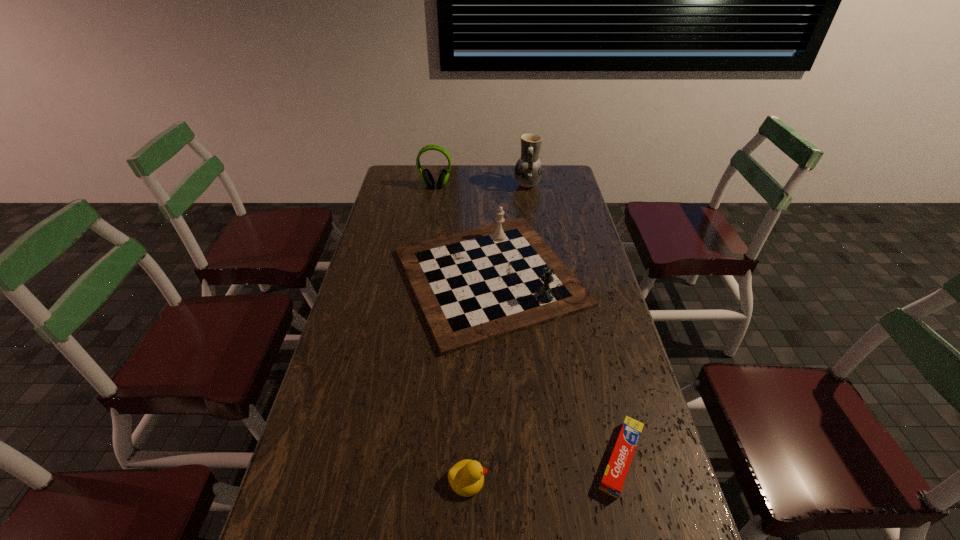
The height and width of the screenshot is (540, 960). I want to click on object situated at the far left corner, so click(427, 178).

Image resolution: width=960 pixels, height=540 pixels. In order to click on object that is at the far right corner in this screenshot , I will do `click(528, 170)`.

Image resolution: width=960 pixels, height=540 pixels. In order to click on vacant space at the far edge of the desktop in this screenshot , I will do `click(458, 177)`.

Find the location of a particular element. free space at the left edge of the desktop is located at coordinates (357, 273).

Where is `vacant space at the right edge`? vacant space at the right edge is located at coordinates (575, 340).

The width and height of the screenshot is (960, 540). I want to click on vacant space in between the third farthest object and the fourth tallest object, so click(478, 379).

The image size is (960, 540). I want to click on empty space between the toothpaste and the gameboard, so click(x=555, y=368).

Identify which object is the closest to the pottery. Please provide its 2D coordinates. Your answer should be formatted as a tuple, i.e. [(x, y)], where the tuple contains the x and y coordinates of a point satisfying the conditions above.

[(475, 286)]

Where is `object that is the fourth closest to the shortest object`? The width and height of the screenshot is (960, 540). object that is the fourth closest to the shortest object is located at coordinates (427, 178).

In order to click on blank space that satisfies the following two spatial constraints: 1. on the front side of the shortest object; 2. on the face of the fourth tallest object in this screenshot , I will do `click(626, 480)`.